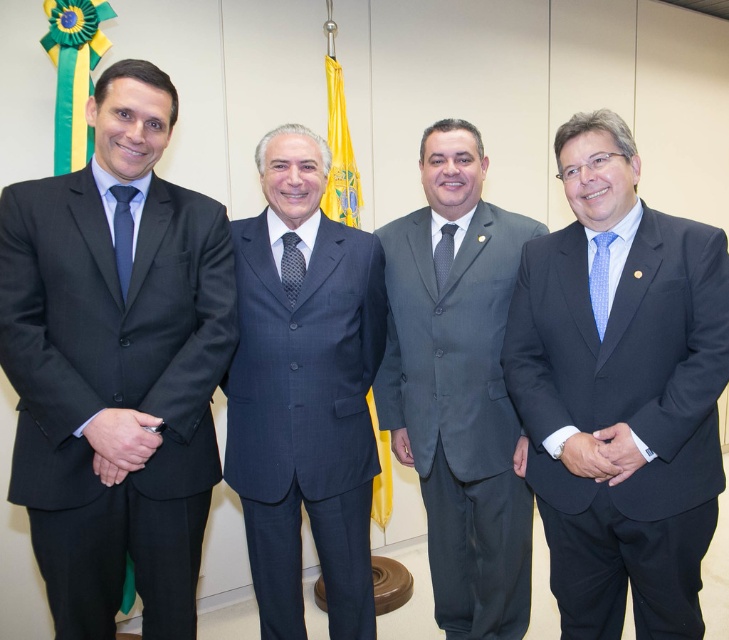
Can you confirm if matte black suit at left is shorter than black dotted tie at center?

No, matte black suit at left is not shorter than black dotted tie at center.

Is matte black suit at left wider than black dotted tie at center?

Indeed, matte black suit at left has a greater width compared to black dotted tie at center.

Locate an element on the screen. Image resolution: width=729 pixels, height=640 pixels. matte black suit at left is located at coordinates (116, 365).

Consider the image. Who is lower down, dark blue suit at right or blue silk tie at left?

dark blue suit at right is lower down.

Is dark blue suit at right shorter than blue silk tie at left?

In fact, dark blue suit at right may be taller than blue silk tie at left.

Measure the distance between dark blue suit at right and camera.

dark blue suit at right and camera are 1.41 meters apart from each other.

This screenshot has height=640, width=729. Identify the location of dark blue suit at right. pos(620,394).

Looking at this image, does matte black suit at left appear on the right side of gray suit at center?

Incorrect, matte black suit at left is not on the right side of gray suit at center.

Who is shorter, matte black suit at left or gray suit at center?

matte black suit at left is shorter.

Is point (15, 262) farther from viewer compared to point (523, 579)?

No, it is not.

Find the location of a particular element. The image size is (729, 640). matte black suit at left is located at coordinates (116, 365).